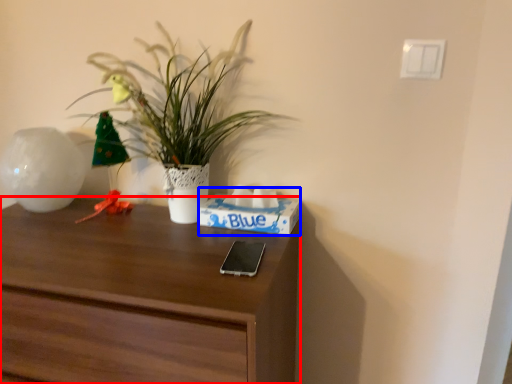
Question: Among these objects, which one is nearest to the camera, desk (highlighted by a red box) or shoe box (highlighted by a blue box)?

Choices:
 (A) desk
 (B) shoe box

Answer: (A)